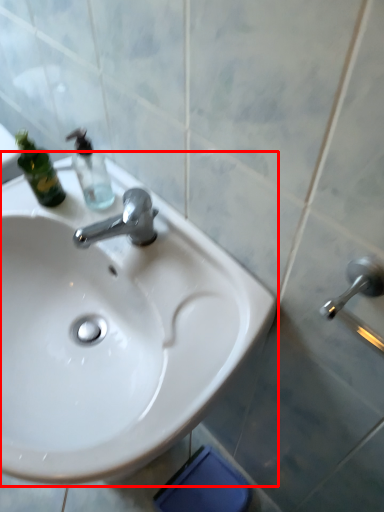
Question: From the image, what is the correct spatial relationship of sink (annotated by the red box) in relation to bottle?

Choices:
 (A) right
 (B) left

Answer: (B)